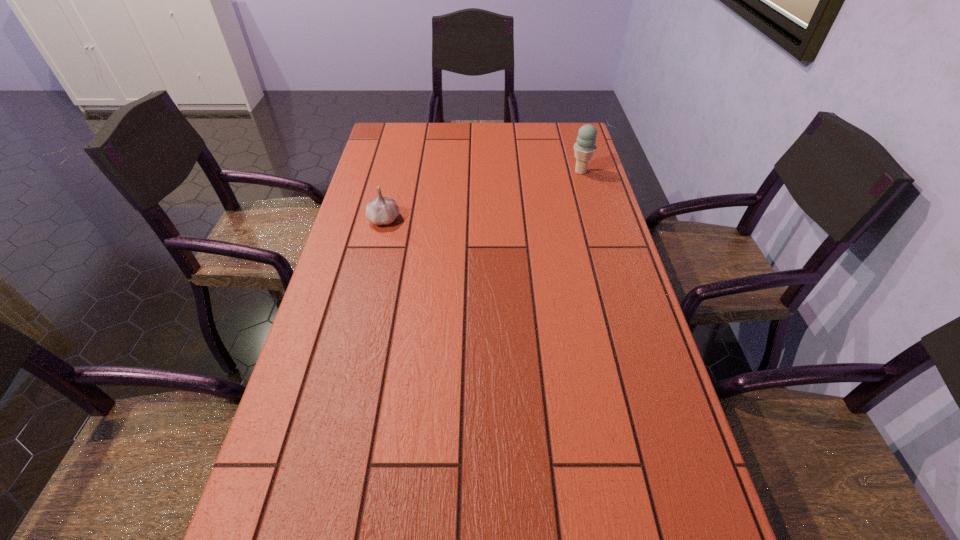
Where is `free space at the right edge of the desktop`? free space at the right edge of the desktop is located at coordinates (568, 165).

At what (x,y) coordinates should I click in order to perform the action: click on vacant space at the far left corner of the desktop. Please return your answer as a coordinate pair (x, y). The image size is (960, 540). Looking at the image, I should click on (374, 152).

Locate an element on the screen. The width and height of the screenshot is (960, 540). free space between the right object and the shorter object is located at coordinates coord(483,195).

The height and width of the screenshot is (540, 960). I want to click on vacant area between the farther object and the shorter object, so click(483, 195).

At what (x,y) coordinates should I click in order to perform the action: click on unoccupied area between the right object and the garlic. Please return your answer as a coordinate pair (x, y). Looking at the image, I should click on (483, 195).

Find the location of a particular element. empty space that is in between the farther object and the shorter object is located at coordinates (483, 195).

At what (x,y) coordinates should I click in order to perform the action: click on vacant point located between the right object and the garlic. Please return your answer as a coordinate pair (x, y). Looking at the image, I should click on (483, 195).

The width and height of the screenshot is (960, 540). Identify the location of vacant space that satisfies the following two spatial constraints: 1. on the back side of the ice cream; 2. on the left side of the nearer object. (396, 172).